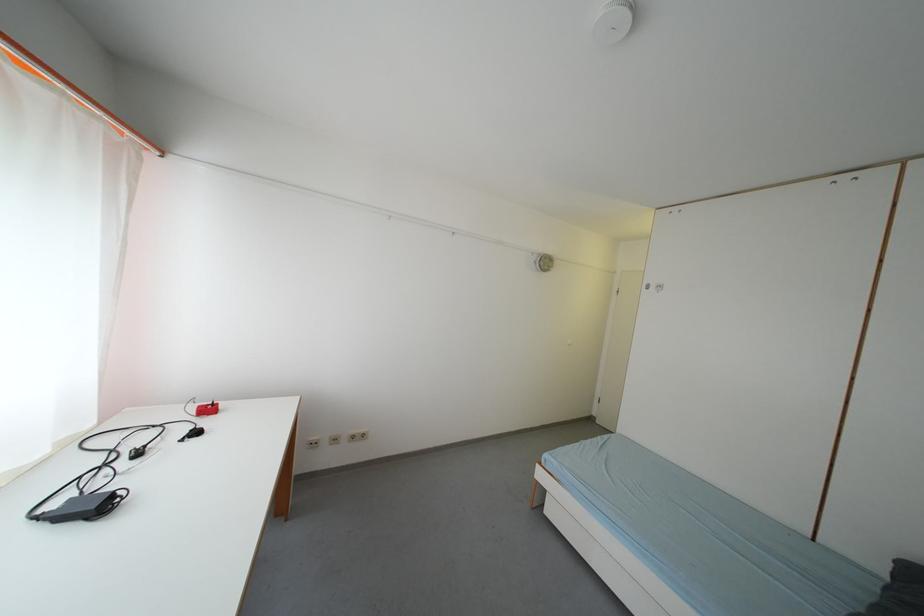
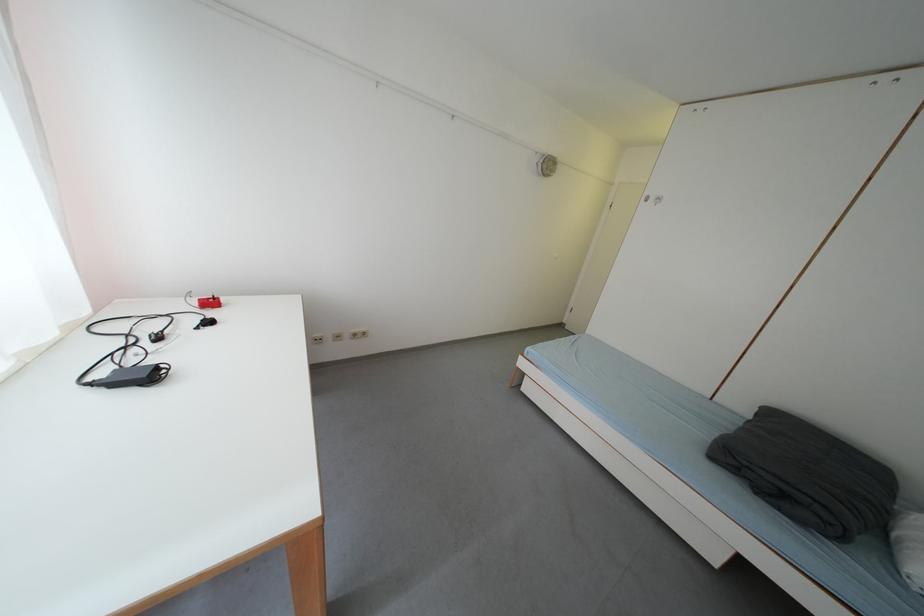
Question: What movement of the cameraman would produce the second image?

Choices:
 (A) Left
 (B) Right
 (C) Forward
 (D) Backward

Answer: (A)